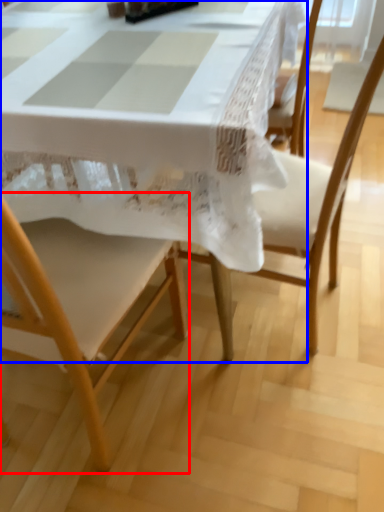
Question: Among these objects, which one is farthest to the camera, chair (highlighted by a red box) or table (highlighted by a blue box)?

Choices:
 (A) chair
 (B) table

Answer: (B)